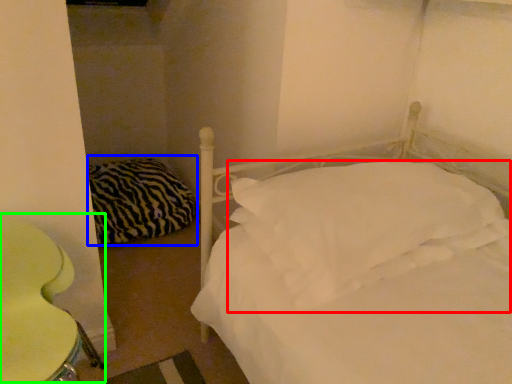
Question: Considering the real-world distances, which object is farthest from pillow (highlighted by a red box)? pillow (highlighted by a blue box) or swivel chair (highlighted by a green box)?

Choices:
 (A) pillow
 (B) swivel chair

Answer: (A)